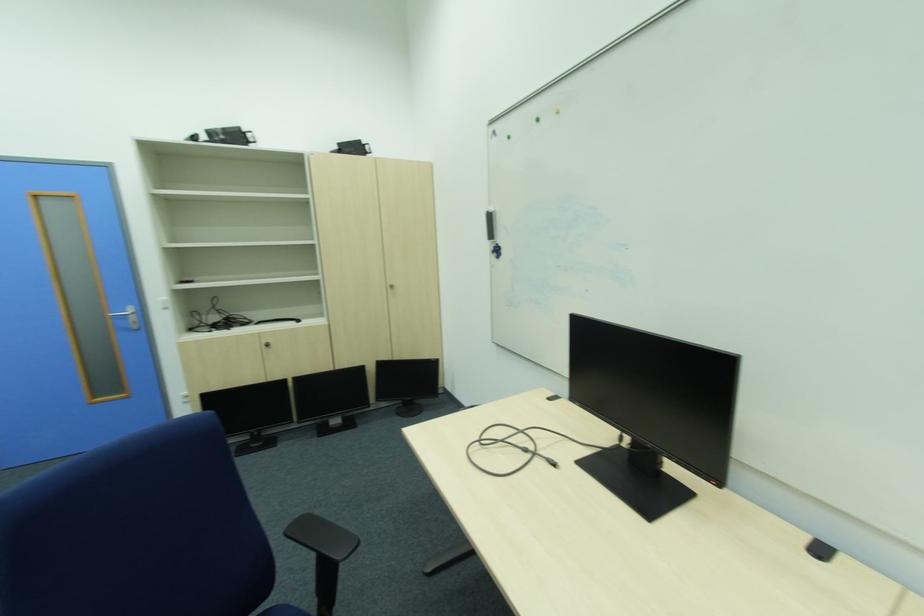
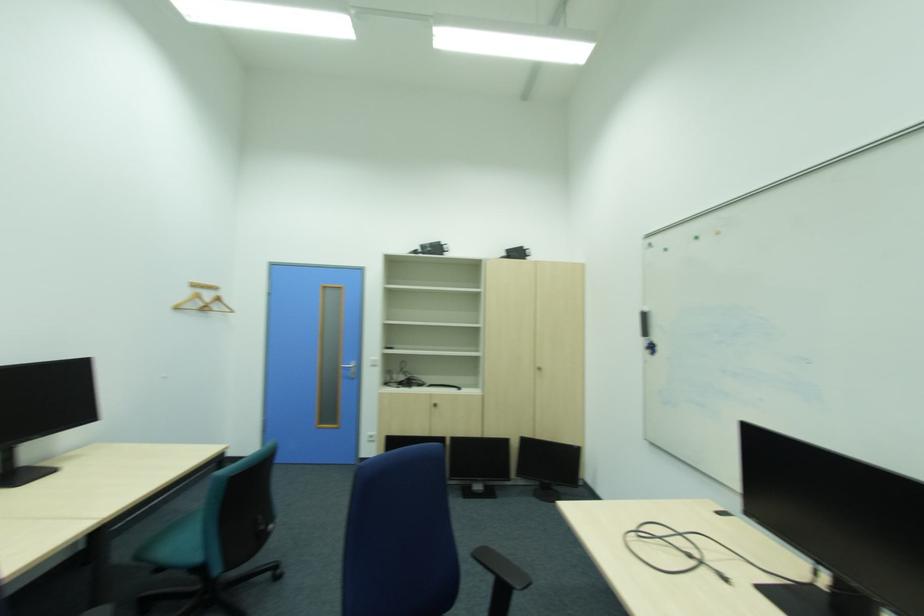
Find the pixel in the second image that matches [625,432] in the first image.

(815, 561)